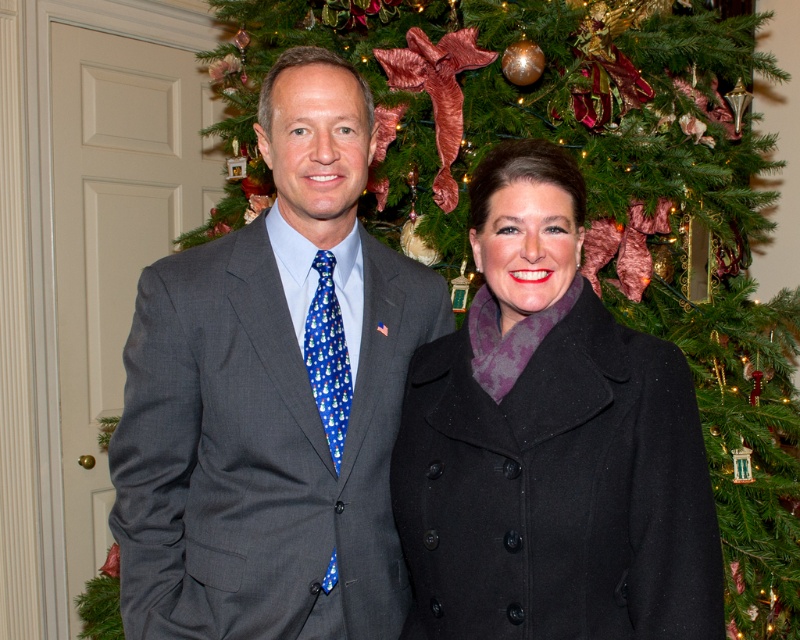
Question: Which point is closer to the camera?

Choices:
 (A) black wool coat at center
 (B) gray suit at center

Answer: (A)

Question: Is the position of gray suit at center less distant than that of black wool coat at center?

Choices:
 (A) no
 (B) yes

Answer: (A)

Question: Is gray suit at center thinner than black wool coat at center?

Choices:
 (A) no
 (B) yes

Answer: (A)

Question: Which point is closer to the camera?

Choices:
 (A) (148, 557)
 (B) (498, 300)

Answer: (B)

Question: Is gray suit at center thinner than black wool coat at center?

Choices:
 (A) no
 (B) yes

Answer: (A)